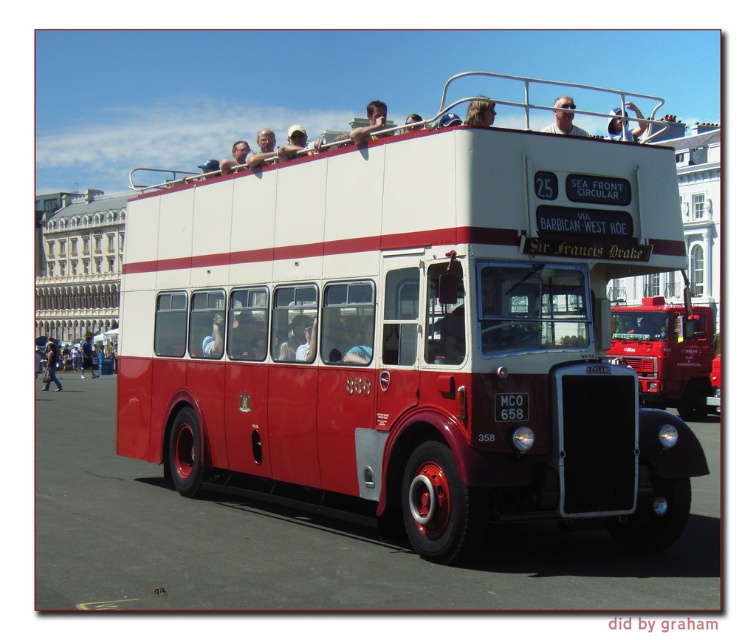
Question: Which object is the farthest from the matte white decker bus at center?

Choices:
 (A) light brown hair at upper center
 (B) matte black sunglasses at upper center

Answer: (A)

Question: Considering the real-world distances, which object is farthest from the white fabric cap at upper center?

Choices:
 (A) matte black camera at upper center
 (B) matte white decker bus at center

Answer: (A)

Question: Is red metallic truck at center above dark blue jeans at lower left?

Choices:
 (A) no
 (B) yes

Answer: (B)

Question: Which of these objects is positioned closest to the matte black camera at upper center?

Choices:
 (A) smooth skin face at upper center
 (B) matte white decker bus at center
 (C) white fabric cap at upper center
 (D) dark blue jeans at lower left

Answer: (B)

Question: From the image, what is the correct spatial relationship of matte black camera at upper center in relation to smooth skin face at upper center?

Choices:
 (A) left
 (B) right

Answer: (B)

Question: Is white fabric cap at upper center closer to the viewer compared to smooth skin face at upper center?

Choices:
 (A) yes
 (B) no

Answer: (A)